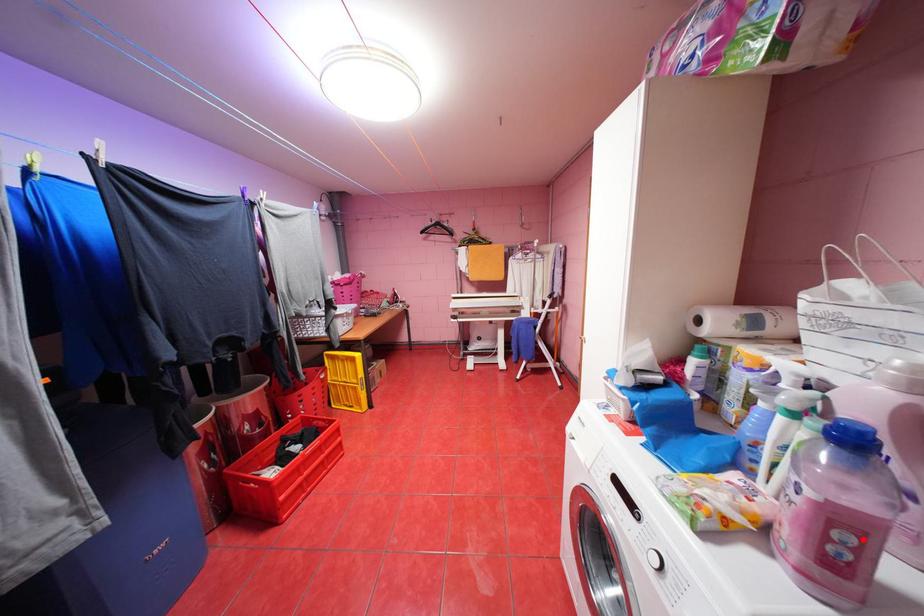
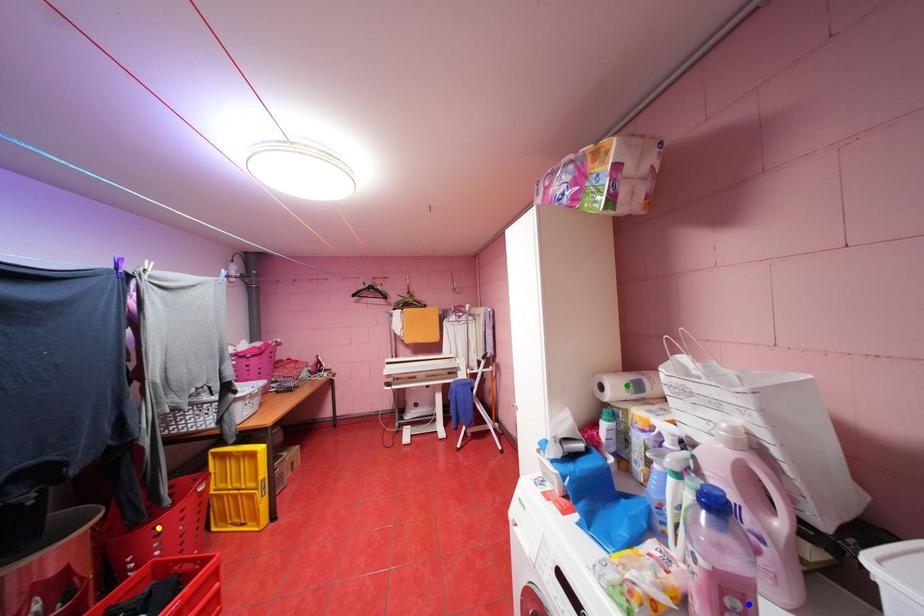
Question: I am providing you with two images of the same scene from different viewpoints. A red point is marked on the first image. You are given multiple points on the second image. Which mark in image 2 goes with the point in image 1?

Choices:
 (A) green point
 (B) yellow point
 (C) blue point

Answer: (C)